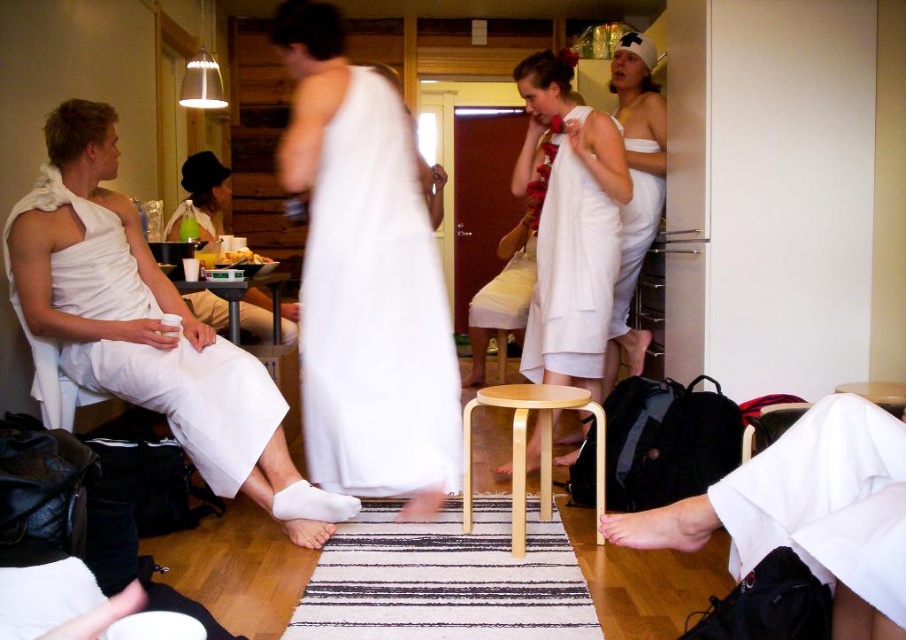
From the picture: You are organizing a costume party and need to decide which outfit to choose based on height. You have a white cotton robe at lower right and a white matte dress at center. Which one is taller?

The white matte dress at center is taller than the white cotton robe at lower right.

You are planning to take a photo of the white cotton robe at lower right and the white matte dress at center. Which one should you focus on first if you want to capture both in the same frame without moving the camera?

You should focus on the white matte dress at center first because the white cotton robe at lower right is positioned on the right side of it, so keeping the dress centered will ensure both are in frame.

What object is located at the coordinates point (589, 211) in the image?

The point (589, 211) corresponds to the white cotton towel at center.